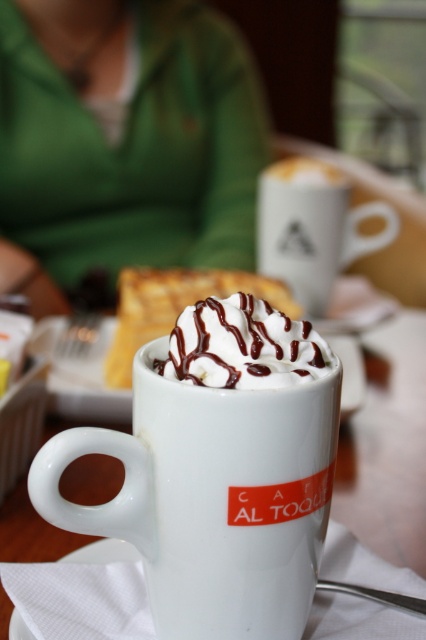
You are a barista holding a tray of drinks and need to place the white matte mug at center on the counter. The counter has a 100 cm depth. Can you safely place the mug at the center of the counter without it falling off the edge?

The white matte mug at center is 91.26 centimeters away from the camera. Since the counter has a depth of 100 cm, placing it at the center would leave enough space on all sides, so yes, it can be safely placed without falling off.

You are a customer at a cafe and want to place your phone on the table. The table has the white ceramic mug at center and a green fabric at upper center. Which object is taller so that you can place your phone on top of it?

The green fabric at upper center is much taller than the white ceramic mug at center, so you can place your phone on top of the green fabric at upper center.

You are a barista trying to place a new whipped cream decoration on the white ceramic mug at center. Considering the size of the whipped cream at center, will it fit on top of the mug?

The white ceramic mug at center is bigger than whipped cream at center, so the whipped cream at center will fit on top of the mug.